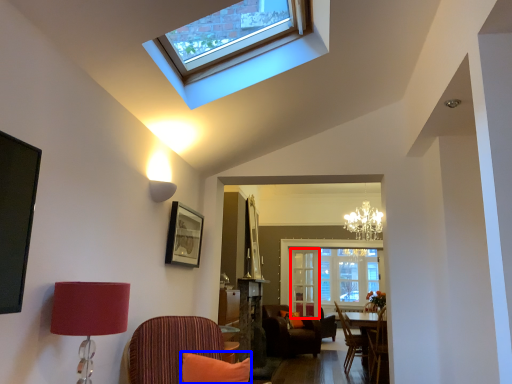
Question: Among these objects, which one is farthest to the camera, glass door (highlighted by a red box) or pillow (highlighted by a blue box)?

Choices:
 (A) glass door
 (B) pillow

Answer: (A)